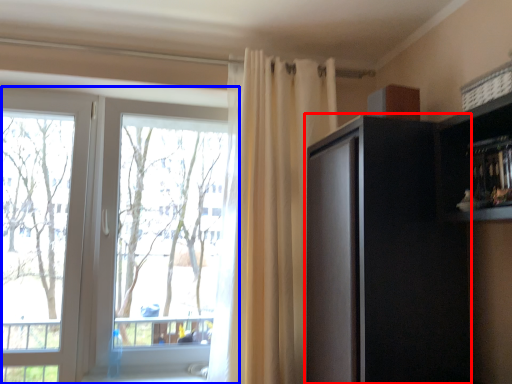
Question: Which object is further to the camera taking this photo, cabinetry (highlighted by a red box) or window (highlighted by a blue box)?

Choices:
 (A) cabinetry
 (B) window

Answer: (B)